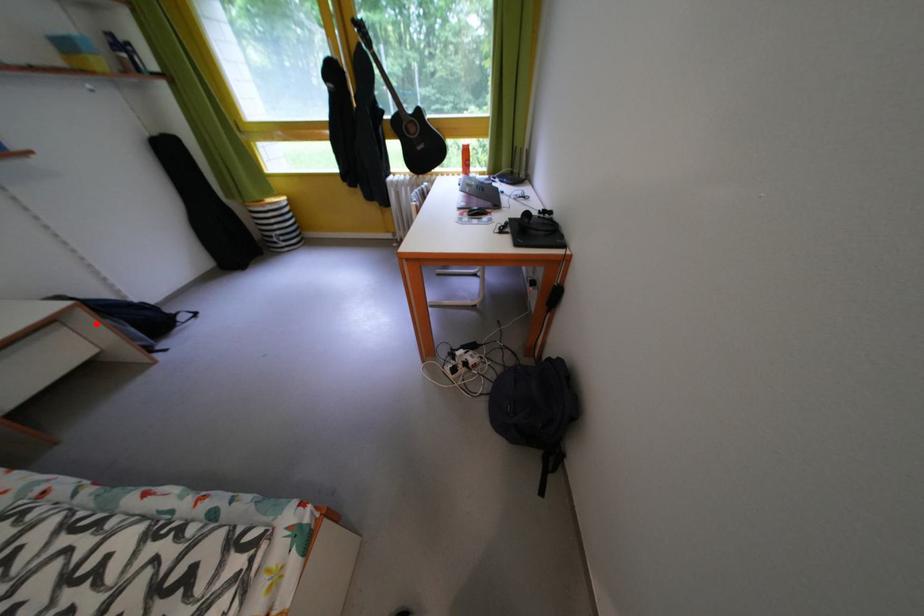
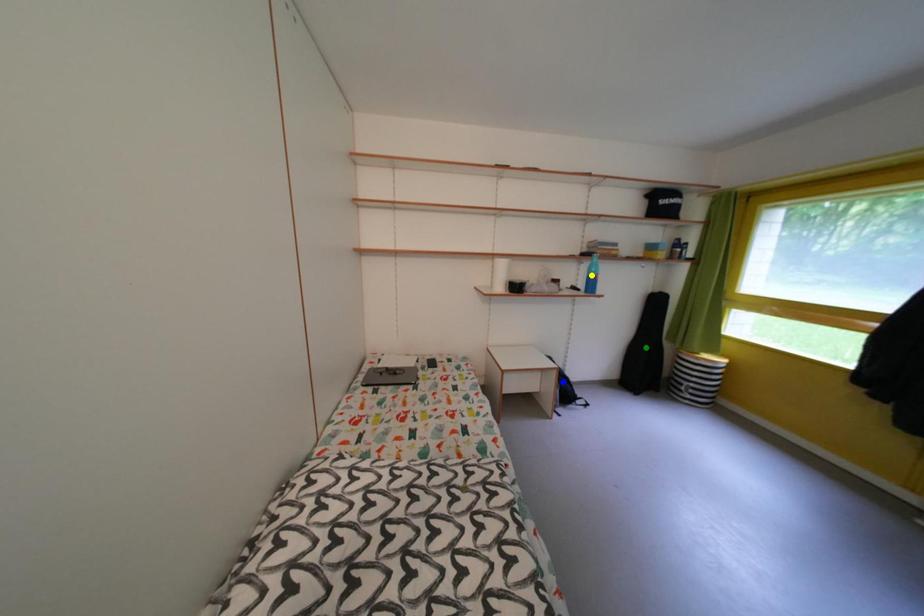
Question: I am providing you with two images of the same scene from different viewpoints. A red point is marked on the first image. You are given multiple points on the second image. Which spot in image 2 lines up with the point in image 1?

Choices:
 (A) green point
 (B) yellow point
 (C) blue point

Answer: (C)